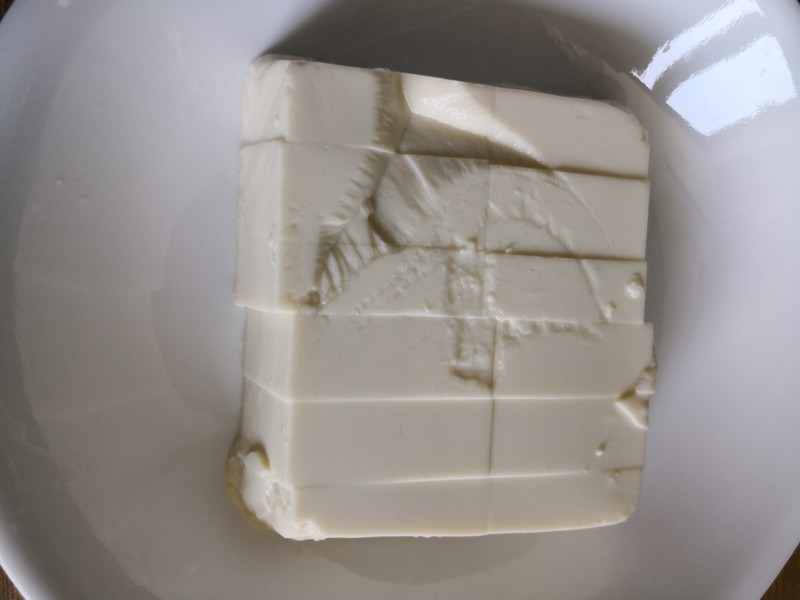
I want to click on white plate, so click(646, 551), click(186, 25).